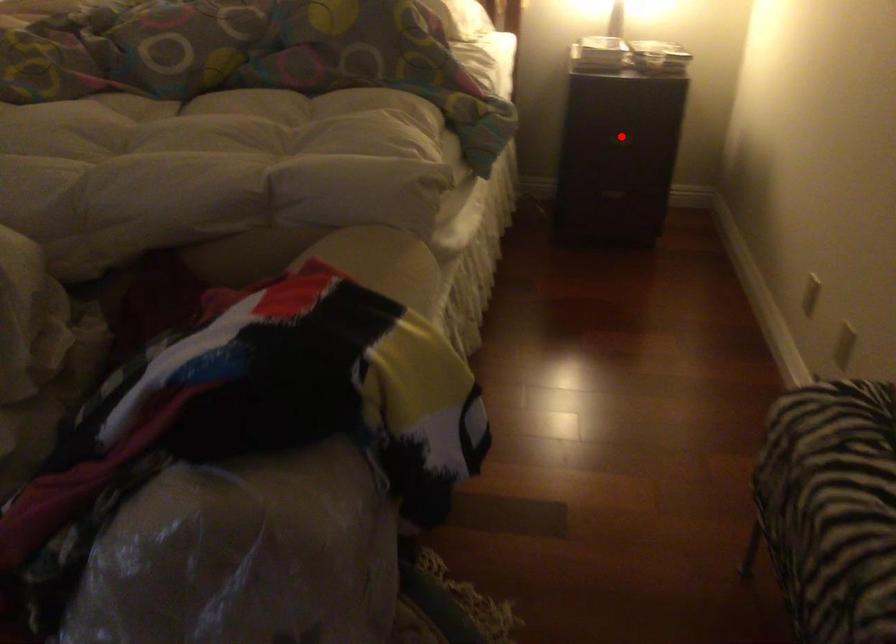
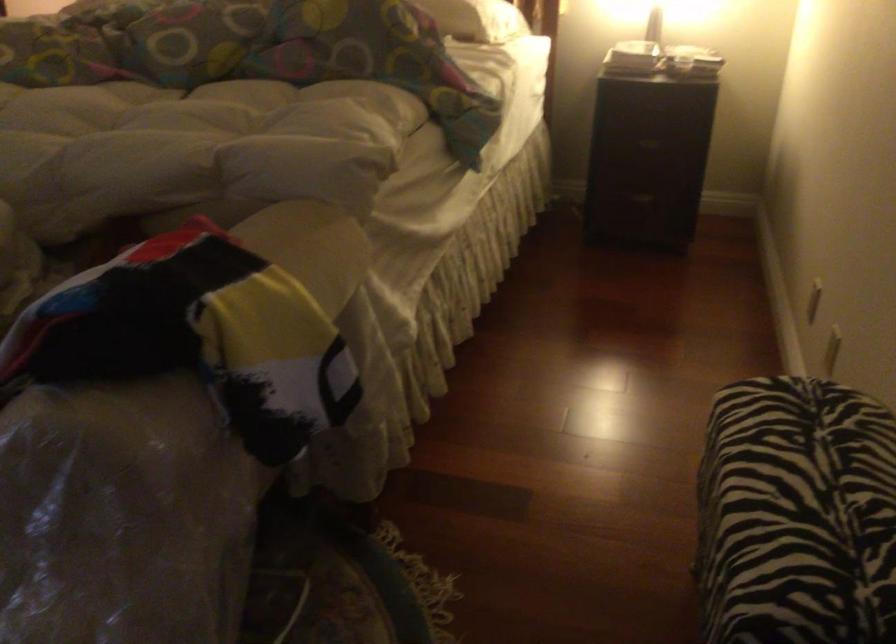
The point at the highlighted location is marked in the first image. Where is the corresponding point in the second image?

(650, 140)